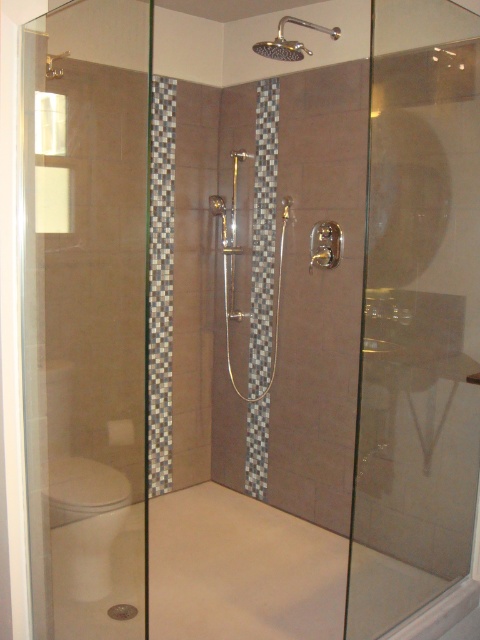
This screenshot has width=480, height=640. What do you see at coordinates (85, 316) in the screenshot?
I see `transparent glass screen door at left` at bounding box center [85, 316].

Consider the image. Between transparent glass screen door at left and transparent glass screen door at right, which one appears on the right side from the viewer's perspective?

transparent glass screen door at right is more to the right.

Where is `transparent glass screen door at left`? The height and width of the screenshot is (640, 480). transparent glass screen door at left is located at coordinates (85, 316).

Who is taller, transparent glass screen door at left or polished chrome shower head at upper center?

transparent glass screen door at left is taller.

Is transparent glass screen door at left bigger than polished chrome shower head at upper center?

Indeed, transparent glass screen door at left has a larger size compared to polished chrome shower head at upper center.

Based on the photo, who is more distant from viewer, (112,268) or (332,29)?

The point (112,268) is more distant.

What are the coordinates of `transparent glass screen door at left` in the screenshot? It's located at (85, 316).

Which of these two, transparent glass screen door at right or polished chrome shower head at upper center, stands shorter?

Standing shorter between the two is polished chrome shower head at upper center.

Does point (455, 388) come behind point (294, 17)?

No, it is not.

Describe the element at coordinates (418, 316) in the screenshot. The height and width of the screenshot is (640, 480). I see `transparent glass screen door at right` at that location.

Where is `transparent glass screen door at right`? The width and height of the screenshot is (480, 640). transparent glass screen door at right is located at coordinates (418, 316).